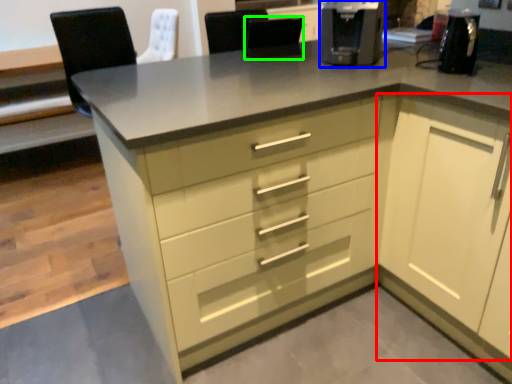
Question: Considering the real-world distances, which object is farthest from cabinetry (highlighted by a red box)? coffee machine (highlighted by a blue box) or chair (highlighted by a green box)?

Choices:
 (A) coffee machine
 (B) chair

Answer: (B)